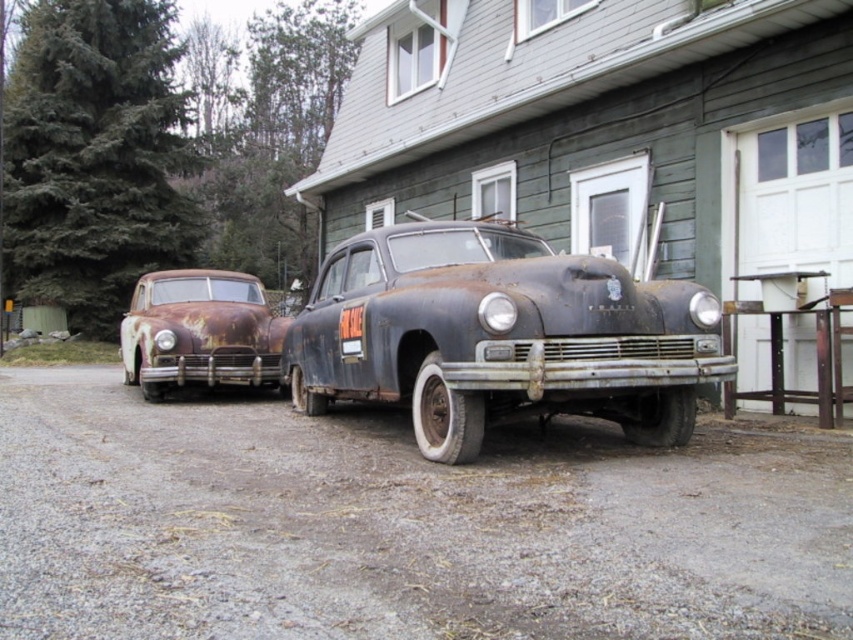
You are standing in front of the two vintage cars and want to cross to the other side of the rusty gravel driveway at lower center. If your stride length is 0.75 meters, how many steps will it take you to cross the driveway?

The rusty gravel driveway at lower center and viewer are 2.77 meters apart. To cross the driveway, you would need to cover approximately 2.77 meters. With a stride length of 0.75 meters per step, dividing 2.77 by 0.75 gives roughly 3.7 steps. Since you can only take whole steps, you would need 4 steps to cross the driveway safely.

You are a delivery person trying to park your van between the rusty gravel driveway at lower center and the rusty metal car at left. Can you safely park your van there if the van requires 2 meters of space?

The rusty gravel driveway at lower center is in front of the rusty metal car at left, but the exact distance between them isn t specified. Without knowing the available space, it s impossible to confirm if the van can safely park there.

You are a photographer trying to capture both rusty metal car at center and rusty metal car at left in a single frame. Since you want to ensure both cars are fully visible, which car should you position closer to the camera to avoid cropping the taller one?

The rusty metal car at left is taller than the rusty metal car at center. To avoid cropping the taller car, position the rusty metal car at left closer to the camera so that its full height fits within the frame.